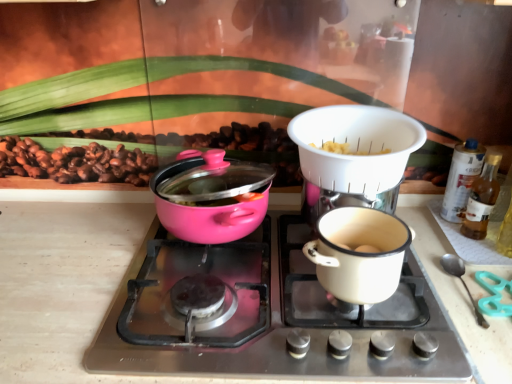
Question: Is point (244, 352) positioned closer to the camera than point (463, 172)?

Choices:
 (A) farther
 (B) closer

Answer: (B)

Question: From the image's perspective, is pink glossy pot at center left above or below translucent plastic spray can at right, placed as the first bottle when sorted from back to front?

Choices:
 (A) below
 (B) above

Answer: (A)

Question: Estimate the real-world distances between objects in this image. Which object is farther from the translucent plastic spray can at right, the 2th bottle when ordered from front to back?

Choices:
 (A) silver spoon at right
 (B) pink glossy pot at left
 (C) pink glossy pot at center left
 (D) white plastic colander at upper center
 (E) translucent glass bottle at right, which ranks as the 1th bottle in front-to-back order

Answer: (B)

Question: Estimate the real-world distances between objects in this image. Which object is farther from the translucent glass bottle at right, which ranks as the 1th bottle in front-to-back order?

Choices:
 (A) white enamel pot at center right
 (B) white plastic colander at upper center
 (C) translucent plastic spray can at right, placed as the first bottle when sorted from back to front
 (D) silver spoon at right
 (E) pink glossy pot at center left

Answer: (E)